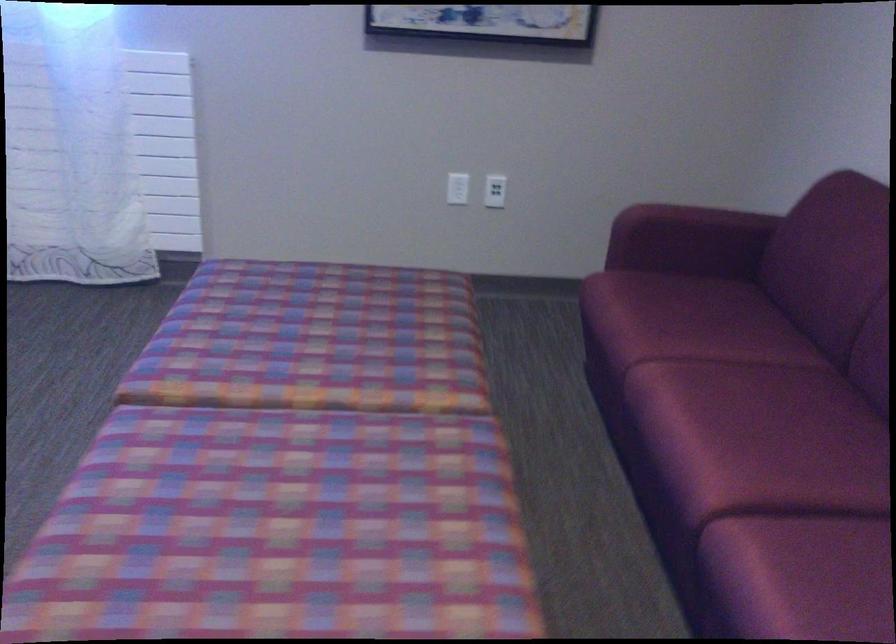
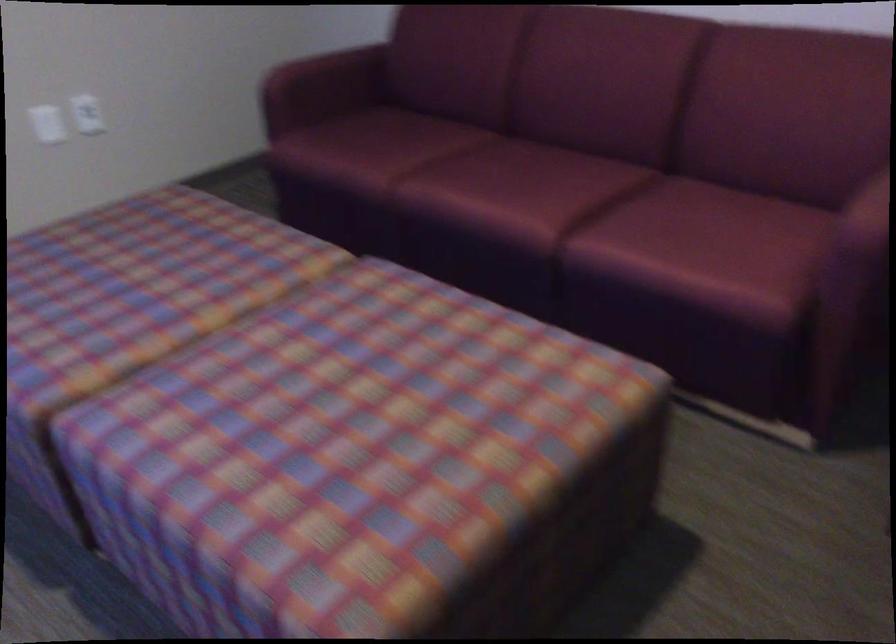
The first image is from the beginning of the video and the second image is from the end. How did the camera likely rotate when shooting the video?

The rotation direction of the camera is right-down.